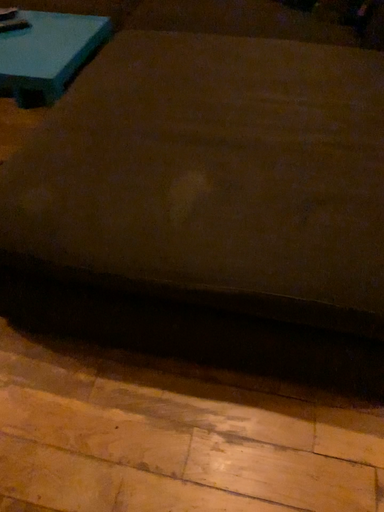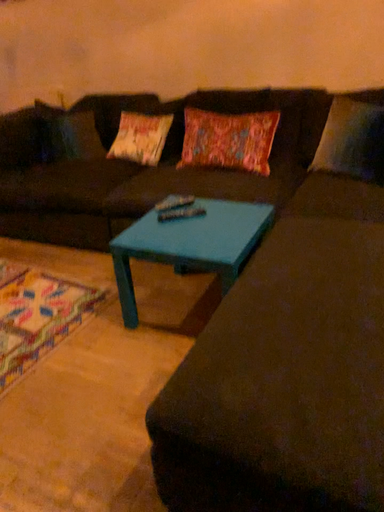
Question: How did the camera likely rotate when shooting the video?

Choices:
 (A) rotated downward
 (B) rotated upward

Answer: (B)